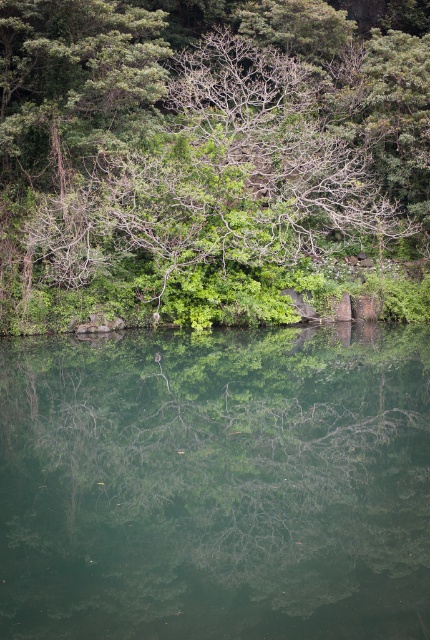
You are standing at the edge of the green reflective water at center and looking towards the green leafy tree at center. Which object is taller from your perspective?

The green leafy tree at center is taller than the green reflective water at center.